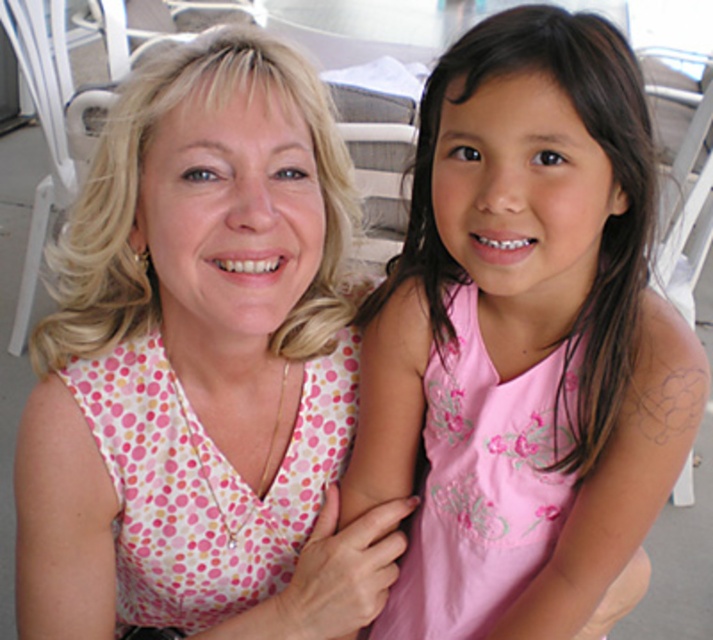
This screenshot has height=640, width=713. Identify the location of pink floral dress at center. point(523,339).

Is pink floral dress at center closer to the viewer compared to pink dotted blouse at center?

Yes.

Who is more distant from viewer, (x=682, y=321) or (x=371, y=554)?

Point (x=371, y=554)

Locate an element on the screen. pink floral dress at center is located at coordinates (523, 339).

Is point (595, 371) less distant than point (481, 577)?

Yes, it is in front of point (481, 577).

Does pink floral dress at center appear on the right side of pink embroidered dress at center?

Yes, pink floral dress at center is to the right of pink embroidered dress at center.

Does point (438, 362) lie behind point (513, 440)?

That is True.

The image size is (713, 640). I want to click on pink floral dress at center, so click(x=523, y=339).

Is point (133, 177) less distant than point (507, 412)?

Yes, it is.

Is point (106, 356) less distant than point (482, 592)?

Yes, point (106, 356) is closer to viewer.

Identify the location of pink dotted blouse at center. (202, 355).